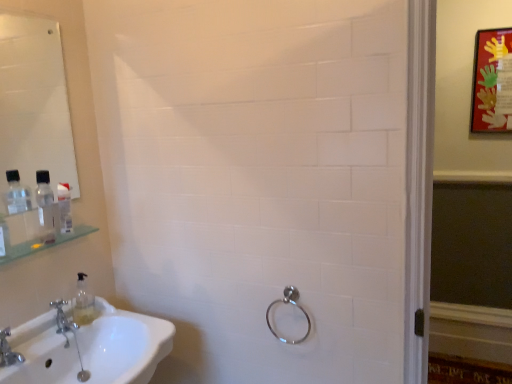
Question: Considering the relative positions of silver metallic faucet at lower left, which is the first tap from back to front, and clear plastic bottle at left in the image provided, is silver metallic faucet at lower left, which is the first tap from back to front, behind clear plastic bottle at left?

Choices:
 (A) yes
 (B) no

Answer: (A)

Question: Is silver metallic faucet at lower left, positioned as the 2th tap in front-to-back order, taller than clear plastic bottle at left?

Choices:
 (A) yes
 (B) no

Answer: (B)

Question: From a real-world perspective, is silver metallic faucet at lower left, which is the 2th tap from left to right, physically below clear plastic bottle at left?

Choices:
 (A) yes
 (B) no

Answer: (A)

Question: Is silver metallic faucet at lower left, which is the 2th tap from left to right, at the right side of clear plastic bottle at left?

Choices:
 (A) no
 (B) yes

Answer: (B)

Question: Considering the relative positions of silver metallic faucet at lower left, which is counted as the 1th tap, starting from the right, and clear plastic bottle at left in the image provided, is silver metallic faucet at lower left, which is counted as the 1th tap, starting from the right, to the left of clear plastic bottle at left from the viewer's perspective?

Choices:
 (A) yes
 (B) no

Answer: (B)

Question: From a real-world perspective, is silver metallic faucet at lower left, which is counted as the 1th tap, starting from the right, on clear plastic bottle at left?

Choices:
 (A) no
 (B) yes

Answer: (A)

Question: Considering the relative positions of white glossy sink at lower left and brushed metal faucet at lower left, acting as the 2th tap starting from the back, in the image provided, is white glossy sink at lower left behind brushed metal faucet at lower left, acting as the 2th tap starting from the back,?

Choices:
 (A) no
 (B) yes

Answer: (A)

Question: Could you tell me if white glossy sink at lower left is facing brushed metal faucet at lower left, acting as the 2th tap starting from the back?

Choices:
 (A) yes
 (B) no

Answer: (B)

Question: Is white glossy sink at lower left directly adjacent to brushed metal faucet at lower left, which is the second tap from right to left?

Choices:
 (A) yes
 (B) no

Answer: (B)

Question: Is white glossy sink at lower left not close to brushed metal faucet at lower left, the 1th tap in the left-to-right sequence?

Choices:
 (A) yes
 (B) no

Answer: (B)

Question: Could brushed metal faucet at lower left, which is the second tap from right to left, be considered to be inside white glossy sink at lower left?

Choices:
 (A) yes
 (B) no

Answer: (A)

Question: Does white glossy sink at lower left have a lesser width compared to brushed metal faucet at lower left, which is the second tap from right to left?

Choices:
 (A) no
 (B) yes

Answer: (A)

Question: Is white glossy sink at lower left far from matte red picture frame at upper right?

Choices:
 (A) no
 (B) yes

Answer: (B)